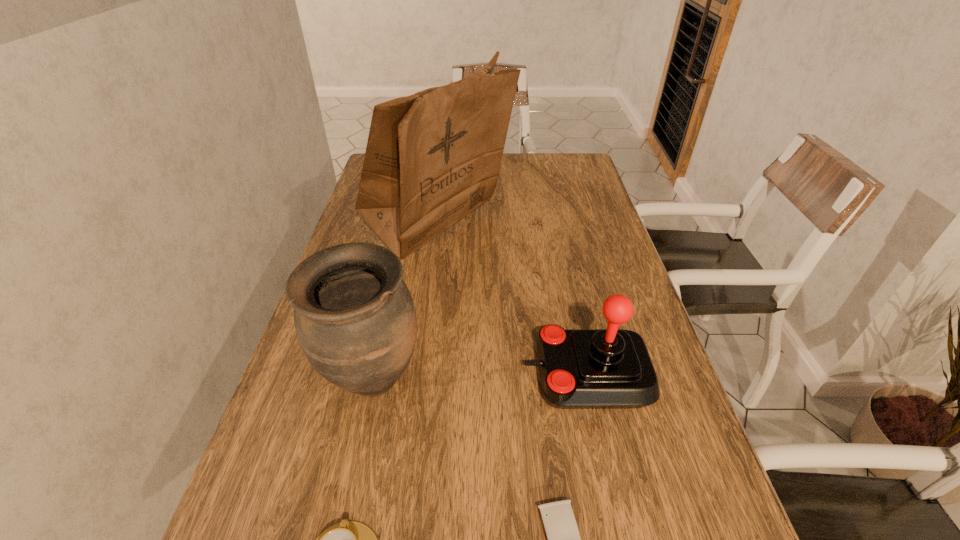
Locate an element on the screen. Image resolution: width=960 pixels, height=540 pixels. urn at the left edge is located at coordinates (355, 320).

The width and height of the screenshot is (960, 540). What are the coordinates of `object that is at the right edge` in the screenshot? It's located at (611, 368).

I want to click on vacant space at the far edge of the desktop, so click(x=519, y=160).

This screenshot has width=960, height=540. In the image, there is a desktop. In order to click on vacant area at the left edge in this screenshot , I will do `click(297, 512)`.

Locate an element on the screen. The height and width of the screenshot is (540, 960). vacant space at the right edge of the desktop is located at coordinates (599, 260).

I want to click on vacant area that lies between the third shortest object and the fourth shortest object, so click(x=480, y=378).

Where is `the fourth closest object to the fourth shortest object`? the fourth closest object to the fourth shortest object is located at coordinates (562, 532).

The image size is (960, 540). Find the location of `object that stands as the third closest to the farthest object`. object that stands as the third closest to the farthest object is located at coordinates (562, 532).